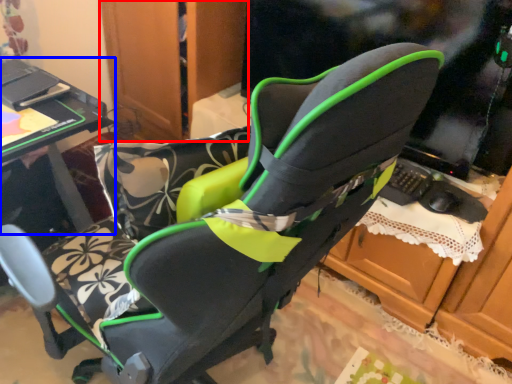
Question: Which object appears closest to the camera in this image, dresser (highlighted by a red box) or table (highlighted by a blue box)?

Choices:
 (A) dresser
 (B) table

Answer: (B)